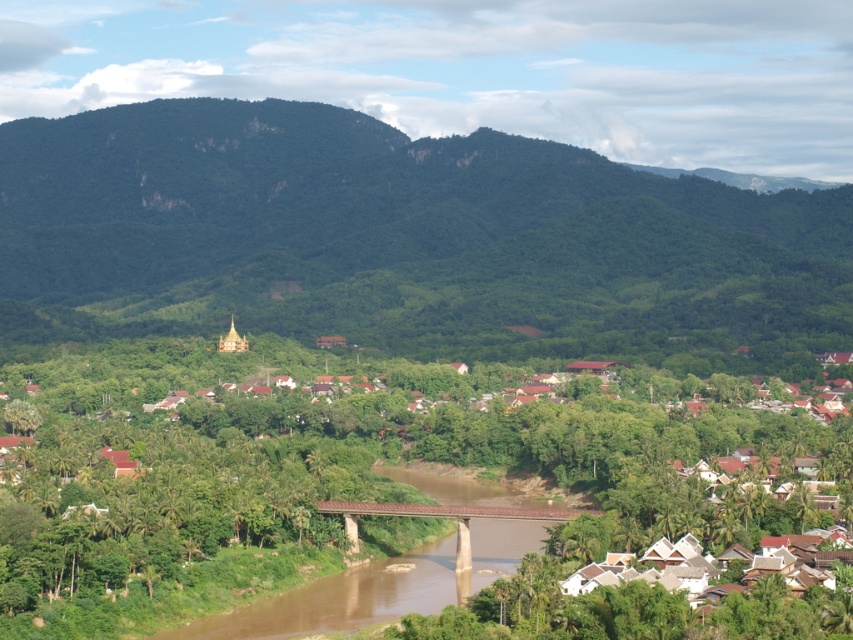
Question: Which object appears farthest from the camera in this image?

Choices:
 (A) white matte houses at center
 (B) green leafy forest at upper center
 (C) brown concrete bridge at center

Answer: (B)

Question: Which object is the closest to the brown concrete bridge at center?

Choices:
 (A) white matte houses at center
 (B) green leafy forest at upper center

Answer: (A)

Question: Can you confirm if green leafy forest at upper center is positioned below white matte houses at center?

Choices:
 (A) no
 (B) yes

Answer: (A)

Question: Can you confirm if green leafy forest at upper center is positioned below brown concrete bridge at center?

Choices:
 (A) yes
 (B) no

Answer: (B)

Question: Can you confirm if green leafy forest at upper center is positioned to the right of brown concrete bridge at center?

Choices:
 (A) no
 (B) yes

Answer: (A)

Question: Which of the following is the closest to the observer?

Choices:
 (A) green leafy forest at upper center
 (B) white matte houses at center
 (C) brown concrete bridge at center

Answer: (B)